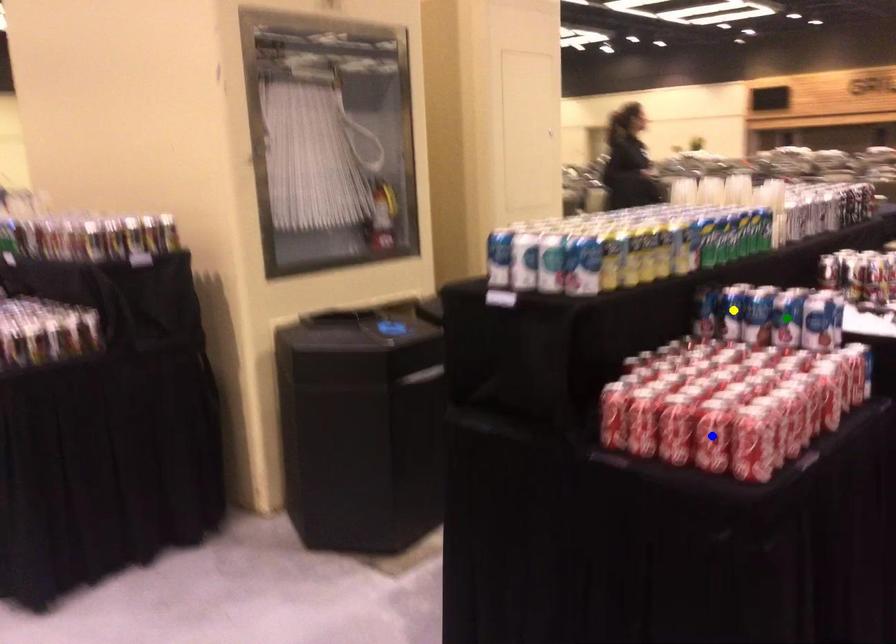
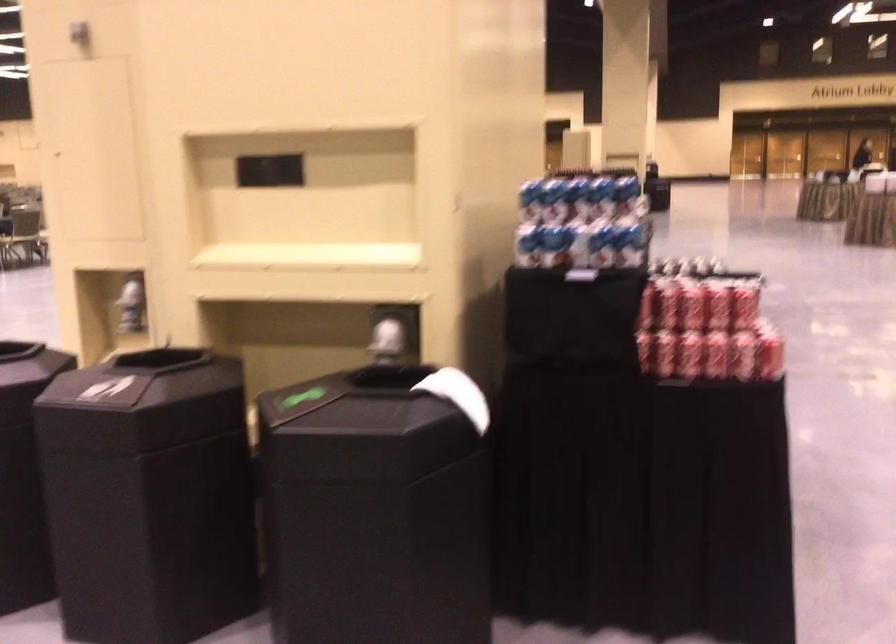
I am providing you with two images of the same scene from different viewpoints. Three points are marked in image1. Which point corresponds to a part or object that is occluded in image2?In image1, three points are marked. Which of them correspond to a part or object that is occluded in image2?Among the three points shown in image1, which one corresponds to a part or object that is no longer visible due to occlusion in image2?

blue point, yellow point, green point cannot be seen in image2.